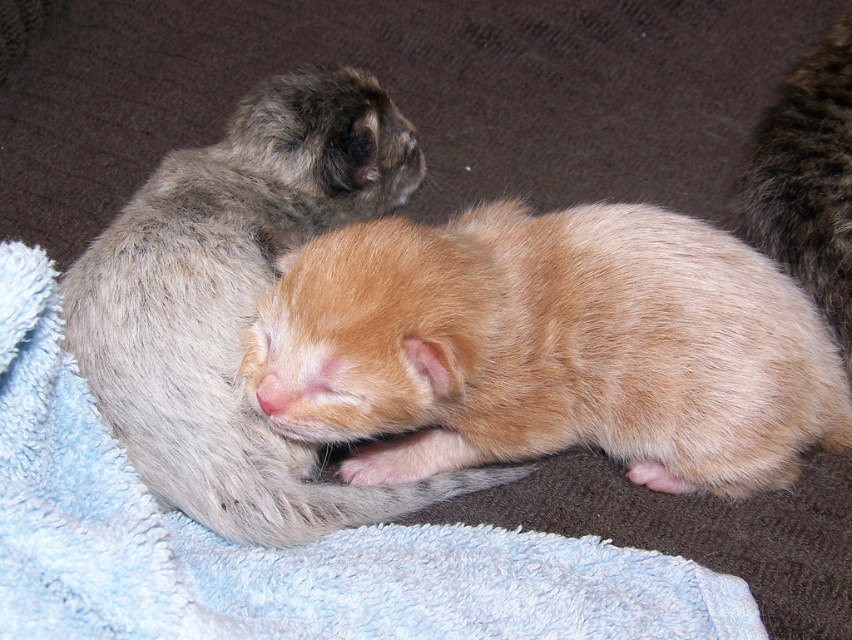
Question: Which of the following is the farthest from the observer?

Choices:
 (A) (160, 436)
 (B) (734, 628)

Answer: (A)

Question: Which of these objects is positioned closest to the blue terry cloth blanket at lower left?

Choices:
 (A) fluffy gray kitten at upper left
 (B) orange fur kitten at center

Answer: (A)

Question: Is orange fur kitten at center wider than fluffy brown fur at upper right?

Choices:
 (A) no
 (B) yes

Answer: (B)

Question: Based on their relative distances, which object is nearer to the orange fur kitten at center?

Choices:
 (A) fluffy gray kitten at upper left
 (B) blue terry cloth blanket at lower left
 (C) fluffy brown fur at upper right

Answer: (A)

Question: Can you confirm if fluffy gray kitten at upper left is wider than fluffy brown fur at upper right?

Choices:
 (A) yes
 (B) no

Answer: (A)

Question: Is fluffy gray kitten at upper left to the right of fluffy brown fur at upper right from the viewer's perspective?

Choices:
 (A) yes
 (B) no

Answer: (B)